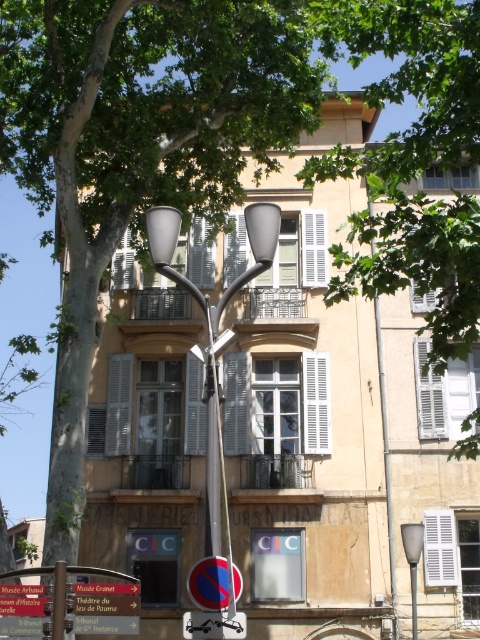
You are a delivery driver who needs to park your metallic reflective tow truck at lower center near the matte gray streetlight at right. The parking spot requires vehicles to be shorter than the streetlight. Can your tow truck fit under the streetlight?

The metallic reflective tow truck at lower center is not as tall as the matte gray streetlight at right, so it can fit under the streetlight.

You are a pedestrian standing on the sidewalk in front of the beige building. You see the metallic reflective sign at lower center and the matte gray streetlight at right. Which object is positioned higher relative to the other?

The metallic reflective sign at lower center is located above the matte gray streetlight at right, so it is positioned higher.

You are a city planner assessing the placement of the satin silver streetlight at center and the metallic pole at center. Given their height differences, which one might obstruct the view for pedestrians walking along the sidewalk closest to them?

The satin silver streetlight at center is much taller than the metallic pole at center, so it is more likely to obstruct the view for pedestrians walking along the sidewalk closest to them.